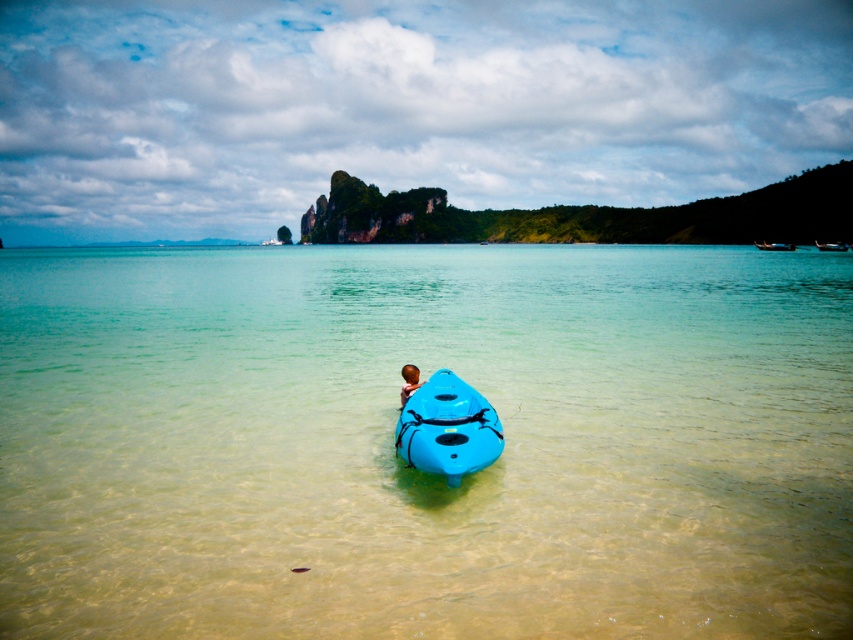
You are planning to take a boat ride and need to choose between the blue plastic kayak at center and the wooden canoe at upper right. Which one is taller?

The blue plastic kayak at center is taller than the wooden canoe at upper right.

You are a photographer planning to capture the blue plastic kayak at center from the shore. Based on its coordinates, would you position yourself to the left or right of the kayak to ensure the island formation in the distance is visible in the background?

Since the blue plastic kayak at center is located at coordinates point (x=775, y=246), positioning yourself to the right of the kayak would allow the island formation in the distance to be visible in the background.

You are a photographer trying to capture the brown hair at center and the wooden canoe at upper right in the same frame. Based on their positions, which object is closer to the camera?

The brown hair at center is located below the wooden canoe at upper right, meaning the wooden canoe at upper right is closer to the camera.